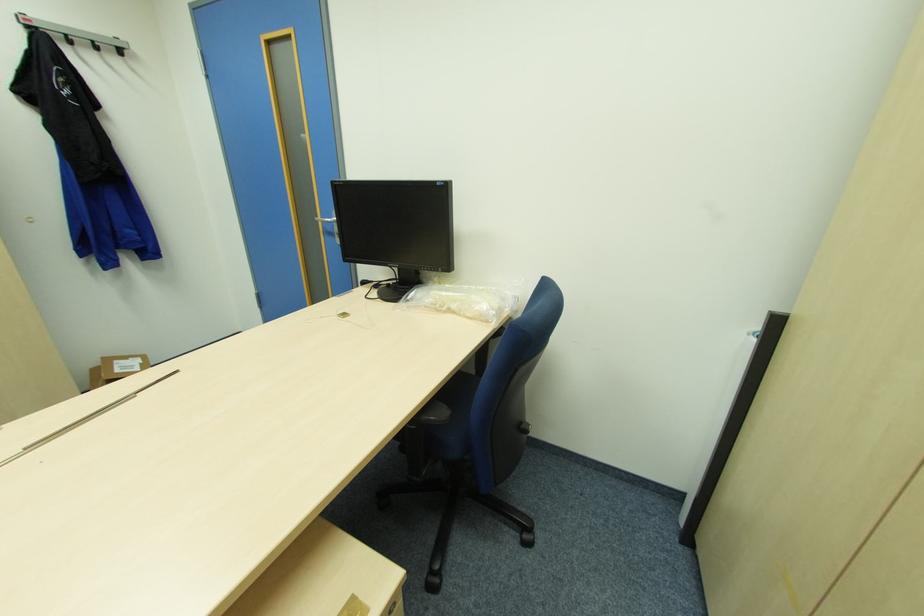
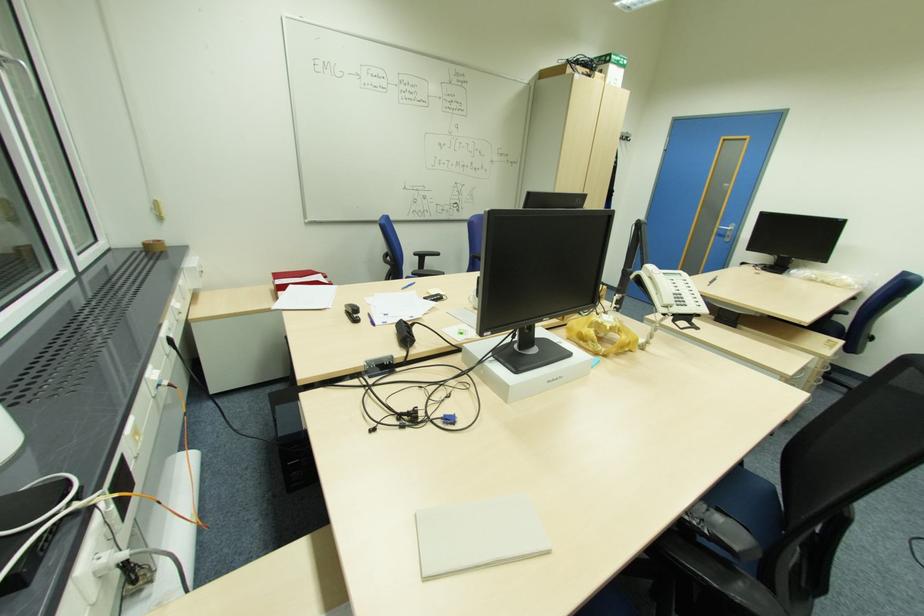
In a continuous first-person perspective shot, in which direction is the camera moving?

The cameraman moved toward left, backward.